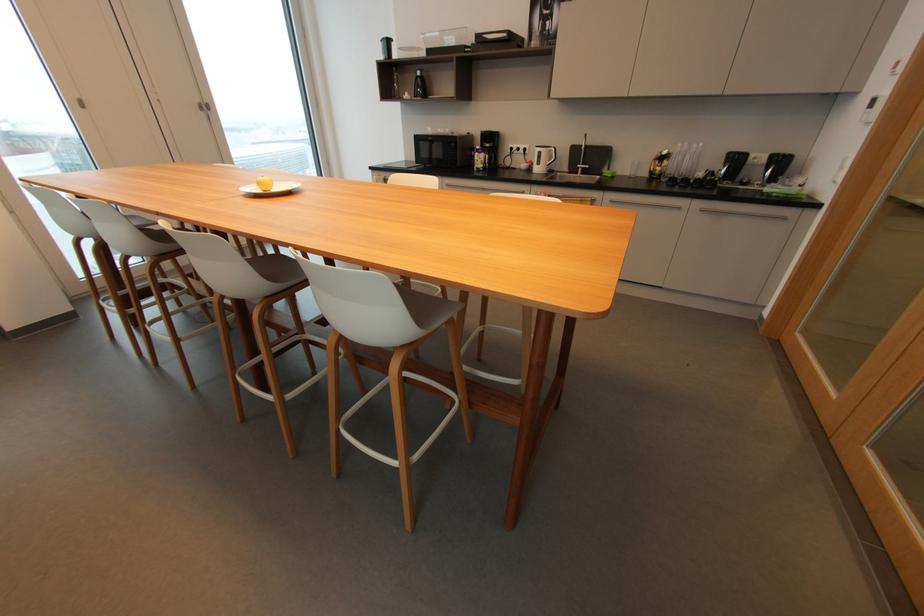
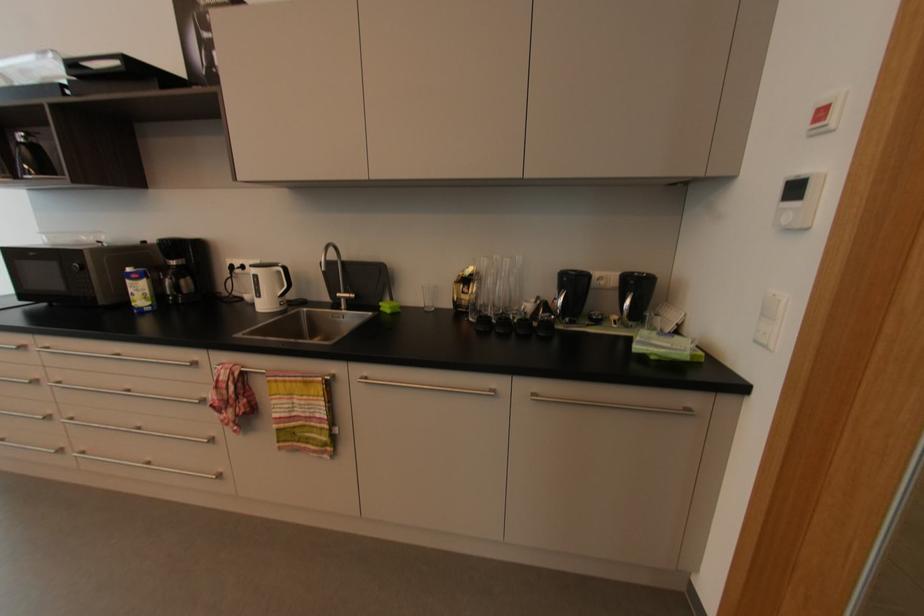
Where in the second image is the point corresponding to point 678,177 from the first image?

(493, 313)